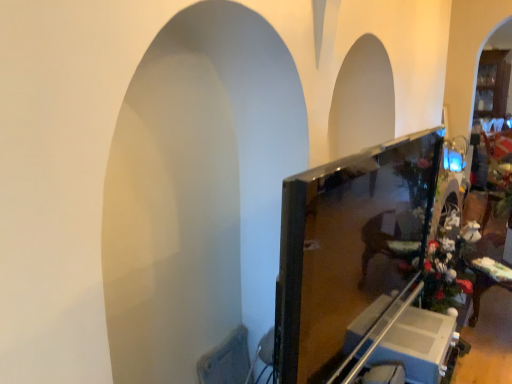
Question: From a real-world perspective, is metallic silver swivel chair at lower right, which appears as the 2th swivel chair when viewed from the left, under matte black monitor at center?

Choices:
 (A) no
 (B) yes

Answer: (B)

Question: Can you confirm if metallic silver swivel chair at lower right, the 1th swivel chair viewed from the right, is shorter than matte black monitor at center?

Choices:
 (A) yes
 (B) no

Answer: (A)

Question: Is the depth of metallic silver swivel chair at lower right, the 1th swivel chair viewed from the right, greater than that of matte black monitor at center?

Choices:
 (A) yes
 (B) no

Answer: (A)

Question: Does metallic silver swivel chair at lower right, the 1th swivel chair viewed from the right, have a larger size compared to matte black monitor at center?

Choices:
 (A) yes
 (B) no

Answer: (B)

Question: Are metallic silver swivel chair at lower right, the 1th swivel chair viewed from the right, and matte black monitor at center beside each other?

Choices:
 (A) yes
 (B) no

Answer: (B)

Question: From their relative heights in the image, would you say white glossy cabinet at lower right is taller or shorter than matte black monitor at center?

Choices:
 (A) short
 (B) tall

Answer: (A)

Question: In the image, is white glossy cabinet at lower right positioned in front of or behind matte black monitor at center?

Choices:
 (A) front
 (B) behind

Answer: (B)

Question: Is point (393, 329) positioned closer to the camera than point (323, 349)?

Choices:
 (A) farther
 (B) closer

Answer: (A)

Question: Looking at the image, does white glossy cabinet at lower right seem bigger or smaller compared to matte black monitor at center?

Choices:
 (A) small
 (B) big

Answer: (A)

Question: Is textured fabric swivel chair at lower left, the 1th swivel chair positioned from the left, in front of or behind metallic silver swivel chair at lower right, which appears as the 2th swivel chair when viewed from the left, in the image?

Choices:
 (A) front
 (B) behind

Answer: (B)

Question: From their relative heights in the image, would you say textured fabric swivel chair at lower left, positioned as the second swivel chair in right-to-left order, is taller or shorter than metallic silver swivel chair at lower right, which appears as the 2th swivel chair when viewed from the left?

Choices:
 (A) tall
 (B) short

Answer: (A)

Question: Based on their sizes in the image, would you say textured fabric swivel chair at lower left, the 1th swivel chair positioned from the left, is bigger or smaller than metallic silver swivel chair at lower right, the 1th swivel chair viewed from the right?

Choices:
 (A) small
 (B) big

Answer: (B)

Question: Does point (243, 364) appear closer or farther from the camera than point (354, 380)?

Choices:
 (A) farther
 (B) closer

Answer: (A)

Question: Is point (387, 365) closer or farther from the camera than point (333, 352)?

Choices:
 (A) farther
 (B) closer

Answer: (A)

Question: From their relative heights in the image, would you say metallic silver swivel chair at lower right, which appears as the 2th swivel chair when viewed from the left, is taller or shorter than matte black monitor at center?

Choices:
 (A) short
 (B) tall

Answer: (A)